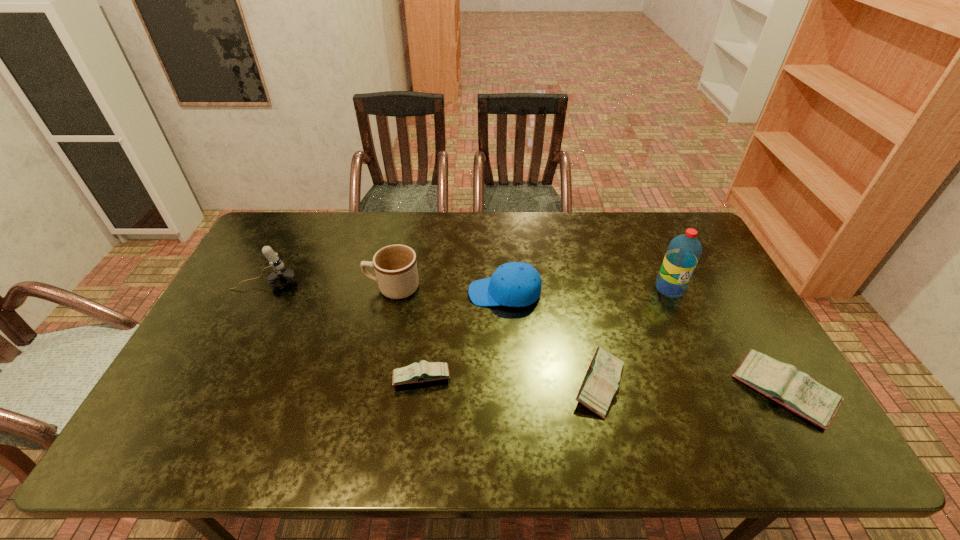
Identify which object is the fourth closest to the second diary from left to right. Please provide its 2D coordinates. Your answer should be formatted as a tuple, i.e. [(x, y)], where the tuple contains the x and y coordinates of a point satisfying the conditions above.

[(424, 371)]

Identify which object is located as the sixth nearest to the fourth shortest object. Please provide its 2D coordinates. Your answer should be formatted as a tuple, i.e. [(x, y)], where the tuple contains the x and y coordinates of a point satisfying the conditions above.

[(281, 277)]

Locate an element on the screen. diary that is the closest to the shortest object is located at coordinates (600, 384).

The height and width of the screenshot is (540, 960). I want to click on the closest diary to the third shortest object, so click(600, 384).

Find the location of a particular element. The image size is (960, 540). vacant region that satisfies the following two spatial constraints: 1. on the front side of the second shortest diary; 2. on the right side of the sixth shortest object is located at coordinates (213, 384).

This screenshot has width=960, height=540. In order to click on free region that satisfies the following two spatial constraints: 1. on the front-facing side of the rightmost object; 2. on the left side of the fourth tallest object in this screenshot , I will do `click(511, 391)`.